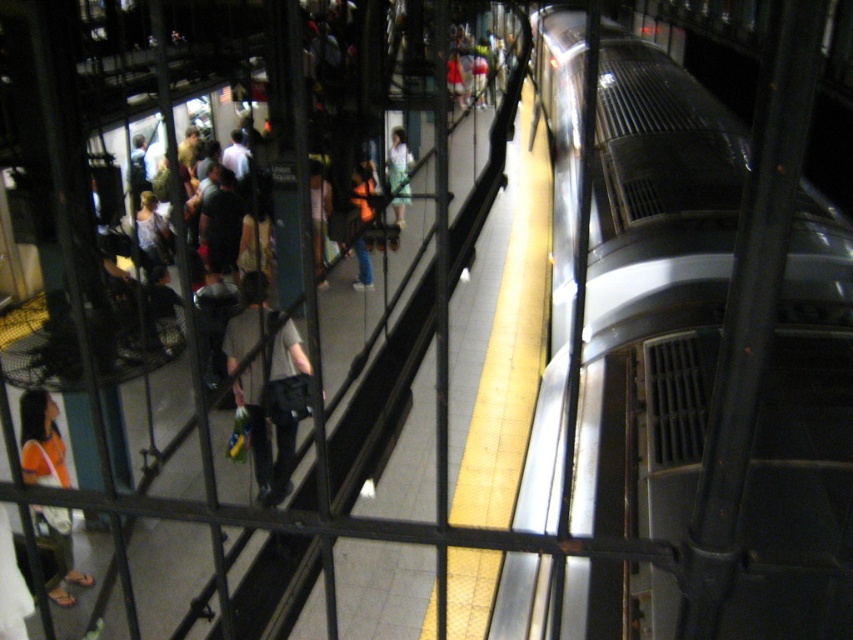
You are a photographer standing on the subway platform. You want to take a photo of the orange fabric shirt at lower left and the light blue fabric dress at center. Can you fit both subjects into your camera frame if your camera has a maximum field of view of 6 meters?

The orange fabric shirt at lower left and light blue fabric dress at center are 7.24 meters apart, which exceeds the camera frame of 6 meters. Therefore, both subjects cannot be captured in a single photo.

You are standing on the subway platform and see the point marked at coordinates (717, 348). Based on the scene description, where exactly is this point located?

The point at coordinates (717, 348) is located on the silver metallic train at right.